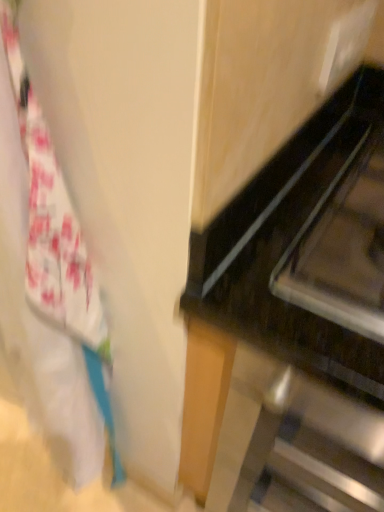
Question: Is black glossy oven at right to the left or to the right of white fabric at left in the image?

Choices:
 (A) left
 (B) right

Answer: (B)

Question: Considering the positions of black glossy oven at right and white fabric at left in the image, is black glossy oven at right wider or thinner than white fabric at left?

Choices:
 (A) wide
 (B) thin

Answer: (A)

Question: Choose the correct answer: Is black glossy oven at right inside white fabric at left or outside it?

Choices:
 (A) outside
 (B) inside

Answer: (A)

Question: Based on their positions, is white fabric at left located to the left or right of black glossy oven at right?

Choices:
 (A) right
 (B) left

Answer: (B)

Question: Do you think white fabric at left is within black glossy oven at right, or outside of it?

Choices:
 (A) inside
 (B) outside

Answer: (B)

Question: From the image's perspective, is white fabric at left above or below black glossy oven at right?

Choices:
 (A) above
 (B) below

Answer: (A)

Question: Considering the positions of white fabric at left and black glossy oven at right in the image, is white fabric at left wider or thinner than black glossy oven at right?

Choices:
 (A) thin
 (B) wide

Answer: (A)